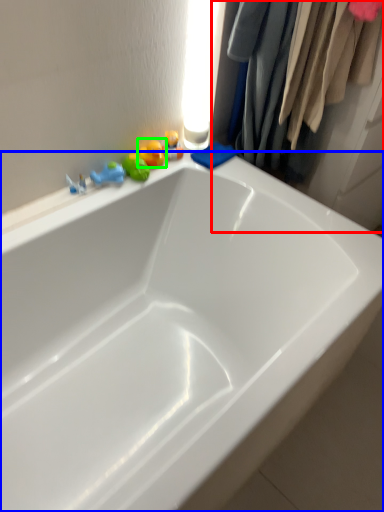
Question: Which object is the farthest from closet (highlighted by a red box)? Choose among these: bathtub (highlighted by a blue box) or toy (highlighted by a green box).

Choices:
 (A) bathtub
 (B) toy

Answer: (A)